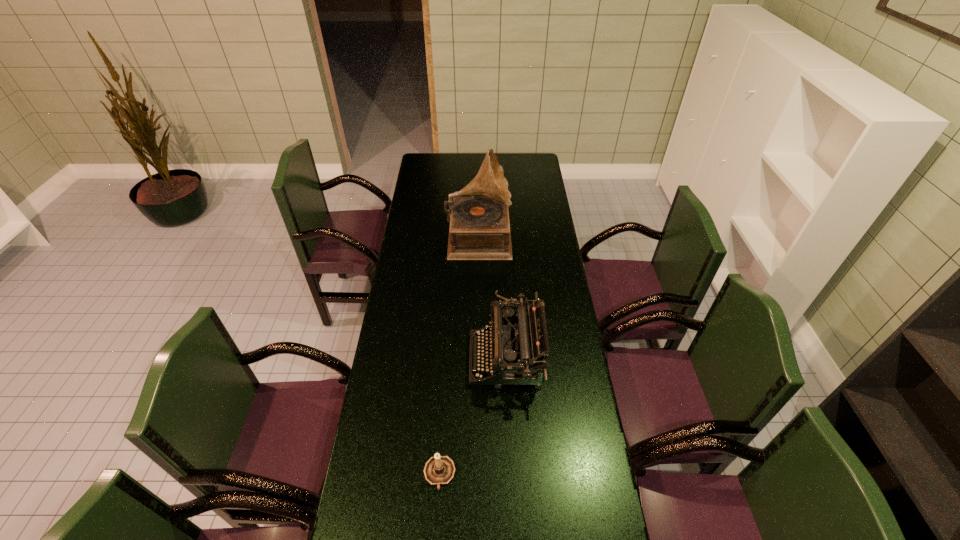
Find the location of a particular element. This screenshot has width=960, height=540. vacant space in between the candle holder and the record player is located at coordinates (459, 354).

At what (x,y) coordinates should I click in order to perform the action: click on free space between the second shortest object and the shortest object. Please return your answer as a coordinate pair (x, y). This screenshot has width=960, height=540. Looking at the image, I should click on (473, 417).

You are a GUI agent. You are given a task and a screenshot of the screen. Output one action in this format:
    pyautogui.click(x=<x>, y=<y>)
    Task: Click on the object identified as the second closest to the typewriter
    
    Given the screenshot: What is the action you would take?
    [x=479, y=229]

I want to click on the closest object relative to the typewriter, so click(439, 470).

Where is `blank area in the image that satisfies the following two spatial constraints: 1. on the keyboard of the second tallest object; 2. on the front side of the candle holder`? The image size is (960, 540). blank area in the image that satisfies the following two spatial constraints: 1. on the keyboard of the second tallest object; 2. on the front side of the candle holder is located at coordinates (513, 474).

Find the location of a particular element. The height and width of the screenshot is (540, 960). free space that satisfies the following two spatial constraints: 1. on the keyboard of the second tallest object; 2. on the front side of the nearest object is located at coordinates (513, 474).